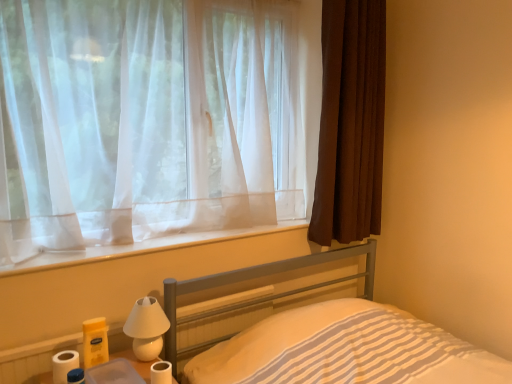
Question: From a real-world perspective, is clear plastic container at lower left on white matte bedside lamp at lower left?

Choices:
 (A) no
 (B) yes

Answer: (A)

Question: From the image's perspective, is clear plastic container at lower left under white matte bedside lamp at lower left?

Choices:
 (A) yes
 (B) no

Answer: (A)

Question: Is clear plastic container at lower left not close to white matte bedside lamp at lower left?

Choices:
 (A) no
 (B) yes

Answer: (A)

Question: Does clear plastic container at lower left come behind white matte bedside lamp at lower left?

Choices:
 (A) yes
 (B) no

Answer: (B)

Question: Is white matte bedside lamp at lower left completely or partially inside clear plastic container at lower left?

Choices:
 (A) no
 (B) yes

Answer: (A)

Question: Relative to brown textured curtain at right, the 1th curtain when ordered from right to left, is white matte toilet paper at lower left, the second toilet paper positioned from the left, in front or behind?

Choices:
 (A) behind
 (B) front

Answer: (B)

Question: Is point (162, 367) positioned closer to the camera than point (353, 211)?

Choices:
 (A) farther
 (B) closer

Answer: (B)

Question: From a real-world perspective, is white matte toilet paper at lower left, the first toilet paper in the right-to-left sequence, positioned above or below brown textured curtain at right, the 1th curtain when ordered from right to left?

Choices:
 (A) above
 (B) below

Answer: (B)

Question: From the image's perspective, relative to brown textured curtain at right, acting as the second curtain starting from the left, is white matte toilet paper at lower left, the first toilet paper in the right-to-left sequence, above or below?

Choices:
 (A) above
 (B) below

Answer: (B)

Question: From the image's perspective, is white sheer curtain at upper left positioned above or below sheer white curtain at upper left, placed as the 1th curtain when sorted from left to right?

Choices:
 (A) above
 (B) below

Answer: (B)

Question: Based on their positions, is white sheer curtain at upper left located to the left or right of sheer white curtain at upper left, placed as the 1th curtain when sorted from left to right?

Choices:
 (A) left
 (B) right

Answer: (B)

Question: In terms of height, does white sheer curtain at upper left look taller or shorter compared to sheer white curtain at upper left, placed as the 1th curtain when sorted from left to right?

Choices:
 (A) tall
 (B) short

Answer: (B)

Question: Is white sheer curtain at upper left inside the boundaries of sheer white curtain at upper left, the second curtain when ordered from right to left, or outside?

Choices:
 (A) outside
 (B) inside

Answer: (A)

Question: Considering the positions of metallic gray bed at lower center and brown textured curtain at right, acting as the second curtain starting from the left, in the image, is metallic gray bed at lower center taller or shorter than brown textured curtain at right, acting as the second curtain starting from the left,?

Choices:
 (A) short
 (B) tall

Answer: (A)

Question: In terms of size, does metallic gray bed at lower center appear bigger or smaller than brown textured curtain at right, acting as the second curtain starting from the left?

Choices:
 (A) small
 (B) big

Answer: (B)